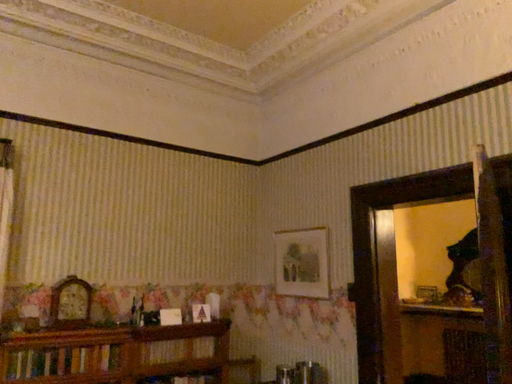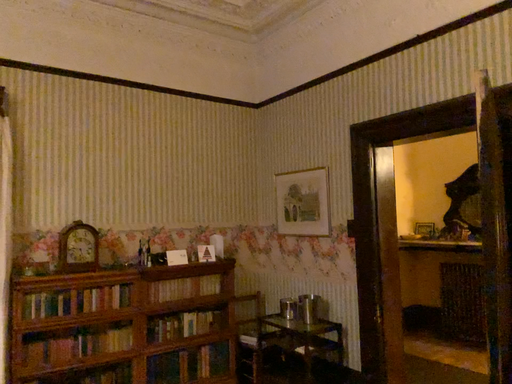
Question: Which way did the camera rotate in the video?

Choices:
 (A) rotated downward
 (B) rotated upward

Answer: (A)